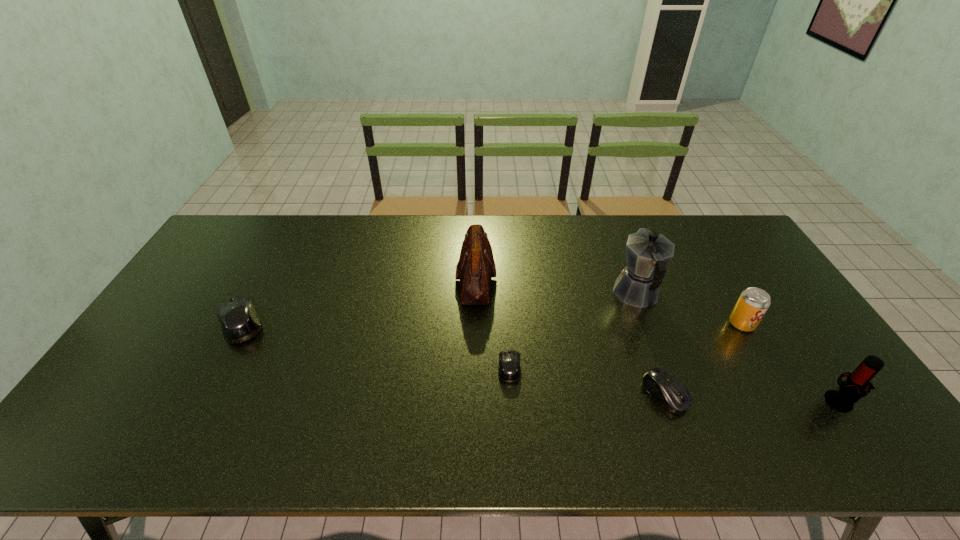
The width and height of the screenshot is (960, 540). I want to click on the tallest mouse, so click(239, 320).

This screenshot has width=960, height=540. I want to click on the farthest mouse, so click(239, 320).

Locate an element on the screen. Image resolution: width=960 pixels, height=540 pixels. the shortest object is located at coordinates click(x=509, y=361).

This screenshot has width=960, height=540. I want to click on the shortest mouse, so click(x=509, y=361).

Where is `the sixth tallest object`? The height and width of the screenshot is (540, 960). the sixth tallest object is located at coordinates (669, 391).

The height and width of the screenshot is (540, 960). In order to click on the rightmost mouse in this screenshot , I will do `click(669, 391)`.

At what (x,y) coordinates should I click in order to perform the action: click on pop (soda). Please return your answer as a coordinate pair (x, y). The image size is (960, 540). Looking at the image, I should click on (753, 303).

Identify the location of the fourth tallest object. (753, 303).

The width and height of the screenshot is (960, 540). In order to click on coffeepot in this screenshot , I will do `click(647, 253)`.

Locate an element on the screen. The width and height of the screenshot is (960, 540). shoulder bag is located at coordinates (476, 266).